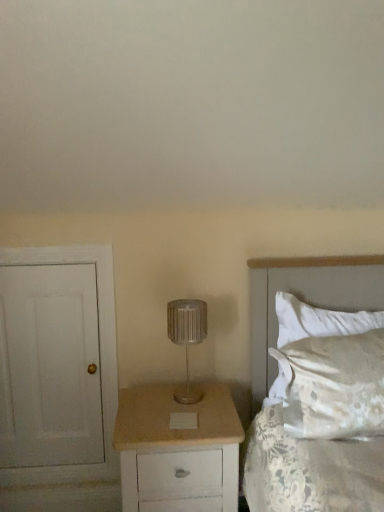
Find the location of a particular element. The height and width of the screenshot is (512, 384). beige wood chest of drawers at center is located at coordinates (177, 450).

Where is `white painted wood door at left`? The width and height of the screenshot is (384, 512). white painted wood door at left is located at coordinates (49, 366).

You are a GUI agent. You are given a task and a screenshot of the screen. Output one action in this format:
    pyautogui.click(x=<x>, y=<y>)
    Task: Click on the white satin pillow at right
    
    Given the screenshot: What is the action you would take?
    pyautogui.click(x=334, y=385)

The image size is (384, 512). Describe the element at coordinates (187, 338) in the screenshot. I see `silver metallic lamp at center` at that location.

Where is `beige wood chest of drawers at center`? This screenshot has height=512, width=384. beige wood chest of drawers at center is located at coordinates (177, 450).

Considering the sizes of objects white painted wood door at left and white satin pillow at right in the image provided, who is smaller, white painted wood door at left or white satin pillow at right?

white painted wood door at left.

In the scene shown: From a real-world perspective, is white painted wood door at left on top of white satin pillow at right?

No, from a real-world perspective, white painted wood door at left is not over white satin pillow at right

Does point (51, 456) come closer to viewer compared to point (304, 414)?

No.

From the picture: Which object is further away from the camera, white painted wood door at left or white satin pillow at right?

white painted wood door at left.

Is white satin bed at right far away from white painted wood door at left?

No, white satin bed at right is in close proximity to white painted wood door at left.

From the image's perspective, between white satin bed at right and white painted wood door at left, which one is located above?

From the image's view, white satin bed at right is above.

In the image, is white satin bed at right positioned in front of or behind white painted wood door at left?

white satin bed at right is in front of white painted wood door at left.

Considering the positions of objects white painted wood door at left and beige wood chest of drawers at center in the image provided, who is in front, white painted wood door at left or beige wood chest of drawers at center?

beige wood chest of drawers at center is in front.

Does point (4, 370) come farther from viewer compared to point (142, 498)?

Yes, point (4, 370) is behind point (142, 498).

Could you tell me if white painted wood door at left is facing beige wood chest of drawers at center?

No, white painted wood door at left is not facing towards beige wood chest of drawers at center.

Is white painted wood door at left to the left of beige wood chest of drawers at center from the viewer's perspective?

Yes.

From the image's perspective, is beige wood chest of drawers at center beneath white painted wood door at left?

Yes.

Is beige wood chest of drawers at center further to camera compared to white painted wood door at left?

No, the depth of beige wood chest of drawers at center is less than that of white painted wood door at left.

Does beige wood chest of drawers at center have a smaller size compared to white painted wood door at left?

Actually, beige wood chest of drawers at center might be larger than white painted wood door at left.

Does beige wood chest of drawers at center appear on the left side of white painted wood door at left?

No.

Between white satin pillow at right and beige wood chest of drawers at center, which one has more height?

beige wood chest of drawers at center is taller.

Are white satin pillow at right and beige wood chest of drawers at center located far from each other?

They are positioned close to each other.

Does white satin pillow at right lie behind beige wood chest of drawers at center?

Yes, it is.

From the image's perspective, is white satin pillow at right on top of beige wood chest of drawers at center?

Yes, from the image's perspective, white satin pillow at right is on top of beige wood chest of drawers at center.

Measure the distance between silver metallic lamp at center and white satin pillow at right.

19.32 inches.

From a real-world perspective, is silver metallic lamp at center on top of white satin pillow at right?

Yes, from a real-world perspective, silver metallic lamp at center is on top of white satin pillow at right.

Between silver metallic lamp at center and white satin pillow at right, which one has larger size?

With larger size is white satin pillow at right.

Is point (180, 303) positioned after point (290, 356)?

Yes.

How many degrees apart are the facing directions of white painted wood door at left and silver metallic lamp at center?

There is a 1.04-degree angle between the facing directions of white painted wood door at left and silver metallic lamp at center.

The image size is (384, 512). I want to click on lamp above the white painted wood door at left (from the image's perspective), so click(187, 338).

Is silver metallic lamp at center at the back of white painted wood door at left?

No, white painted wood door at left is not facing away from silver metallic lamp at center.

Can you see white painted wood door at left touching silver metallic lamp at center?

No, white painted wood door at left is not making contact with silver metallic lamp at center.

At what (x,y) coordinates should I click in order to perform the action: click on pillow that appears above the white painted wood door at left (from the image's perspective). Please return your answer as a coordinate pair (x, y). This screenshot has width=384, height=512. Looking at the image, I should click on (334, 385).

This screenshot has width=384, height=512. In order to click on bed in front of the white painted wood door at left in this screenshot , I will do `click(305, 298)`.

Looking at the image, which one is located further to white satin bed at right, beige wood chest of drawers at center or white painted wood door at left?

Based on the image, white painted wood door at left appears to be further to white satin bed at right.

Which object lies nearer to the anchor point white satin bed at right, white satin pillow at right or white painted wood door at left?

Among the two, white satin pillow at right is located nearer to white satin bed at right.

Considering their positions, is white painted wood door at left positioned further to white satin pillow at right than beige wood chest of drawers at center?

Among the two, white painted wood door at left is located further to white satin pillow at right.

Looking at the image, which one is located further to silver metallic lamp at center, white satin bed at right or white satin pillow at right?

white satin pillow at right is further to silver metallic lamp at center.

When comparing their distances from white satin bed at right, does white painted wood door at left or white satin pillow at right seem further?

white painted wood door at left lies further to white satin bed at right than the other object.

Based on their spatial positions, is silver metallic lamp at center or beige wood chest of drawers at center closer to white painted wood door at left?

The object closer to white painted wood door at left is beige wood chest of drawers at center.

In the scene shown: When comparing their distances from silver metallic lamp at center, does white satin bed at right or beige wood chest of drawers at center seem further?

white satin bed at right is further to silver metallic lamp at center.

Estimate the real-world distances between objects in this image. Which object is further from white satin pillow at right, white satin bed at right or white painted wood door at left?

Among the two, white painted wood door at left is located further to white satin pillow at right.

Find the location of `lamp situated between white painted wood door at left and white satin bed at right from left to right`. lamp situated between white painted wood door at left and white satin bed at right from left to right is located at coordinates (187, 338).

Locate an element on the screen. The image size is (384, 512). chest of drawers between white painted wood door at left and white satin bed at right from left to right is located at coordinates (177, 450).

Identify the location of bed between beige wood chest of drawers at center and white satin pillow at right in the horizontal direction. This screenshot has height=512, width=384. (305, 298).

Find the location of `lamp between white painted wood door at left and white satin pillow at right in the horizontal direction`. lamp between white painted wood door at left and white satin pillow at right in the horizontal direction is located at coordinates (187, 338).